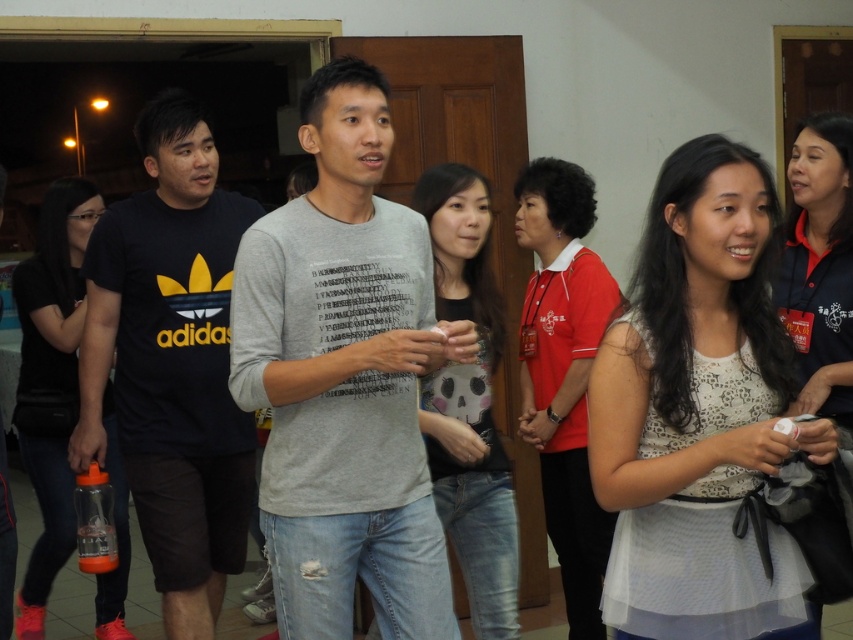
Can you confirm if gray cotton t-shirt at center is smaller than black matte t-shirt at left?

Yes.

Who is positioned more to the left, gray cotton t-shirt at center or black matte t-shirt at left?

black matte t-shirt at left is more to the left.

Which is behind, point (426, 554) or point (167, 461)?

Positioned behind is point (167, 461).

The height and width of the screenshot is (640, 853). What are the coordinates of `gray cotton t-shirt at center` in the screenshot? It's located at (345, 378).